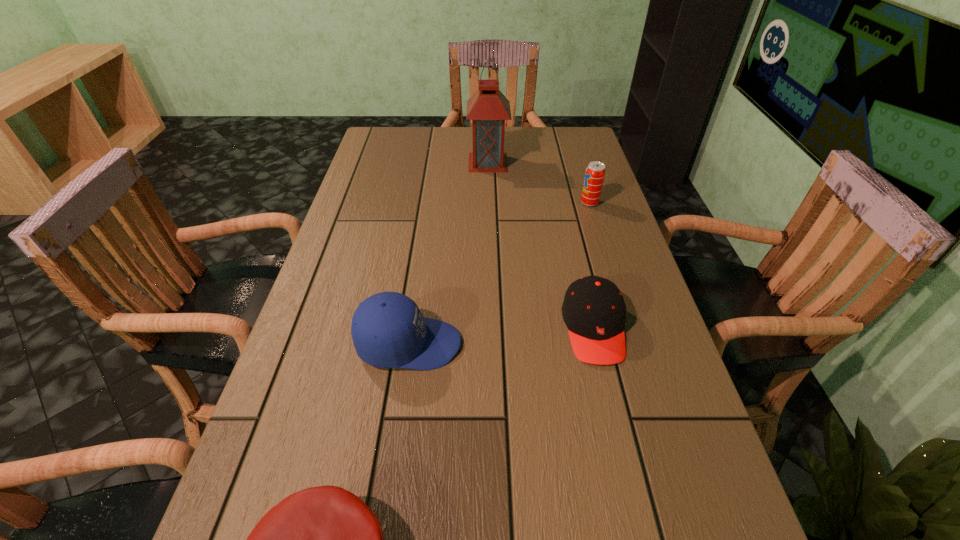
Locate an element on the screen. Image resolution: width=960 pixels, height=540 pixels. vacant point located between the fourth nearest object and the tallest object is located at coordinates (539, 183).

The image size is (960, 540). In order to click on free space between the farthest object and the tallest cap in this screenshot , I will do `click(448, 253)`.

The image size is (960, 540). Find the location of `free area in between the lantern and the second farthest object`. free area in between the lantern and the second farthest object is located at coordinates (539, 183).

Find the location of a particular element. Image resolution: width=960 pixels, height=540 pixels. unoccupied position between the tallest object and the rightmost cap is located at coordinates (540, 245).

You are a GUI agent. You are given a task and a screenshot of the screen. Output one action in this format:
    pyautogui.click(x=<x>, y=<y>)
    Task: Click on the object that is the closest to the tallest cap
    
    Given the screenshot: What is the action you would take?
    point(594,311)

Locate which object is the third closest to the nearest object. Please provide its 2D coordinates. Your answer should be formatted as a tuple, i.e. [(x, y)], where the tuple contains the x and y coordinates of a point satisfying the conditions above.

[(595, 172)]

Locate an element on the screen. The width and height of the screenshot is (960, 540). cap that is the second closest to the rightmost cap is located at coordinates click(x=324, y=539).

Image resolution: width=960 pixels, height=540 pixels. I want to click on cap that is the nearest to the nearest cap, so click(388, 330).

At what (x,y) coordinates should I click in order to perform the action: click on vacant region that satisfies the following two spatial constraints: 1. on the front side of the soda can; 2. on the left side of the farthest object. Please return your answer as a coordinate pair (x, y). The width and height of the screenshot is (960, 540). Looking at the image, I should click on (489, 203).

This screenshot has width=960, height=540. In order to click on vacant space that satisfies the following two spatial constraints: 1. on the front-facing side of the rightmost cap; 2. on the front-facing side of the tallest cap in this screenshot , I will do `click(597, 344)`.